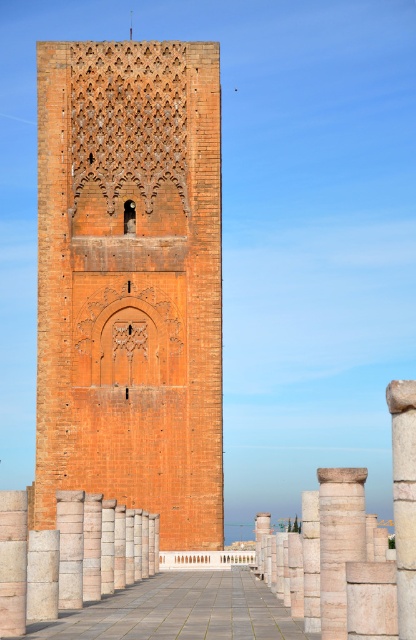
You are standing on the paved walkway leading to the brick tower and notice two columns ahead. Which column, the light beige stone column at center or the white stone column at center, appears narrower?

The light beige stone column at center appears narrower than the white stone column at center because it occupies less space.

You are standing at the base of the tower and want to place a small decorative pot exactly where the point marked as point (339,541) is located. Is this location suitable for placing the pot?

The point (339,541) marks a light beige stone column at center, so placing the pot there would not be possible as the column is already occupying that spot.